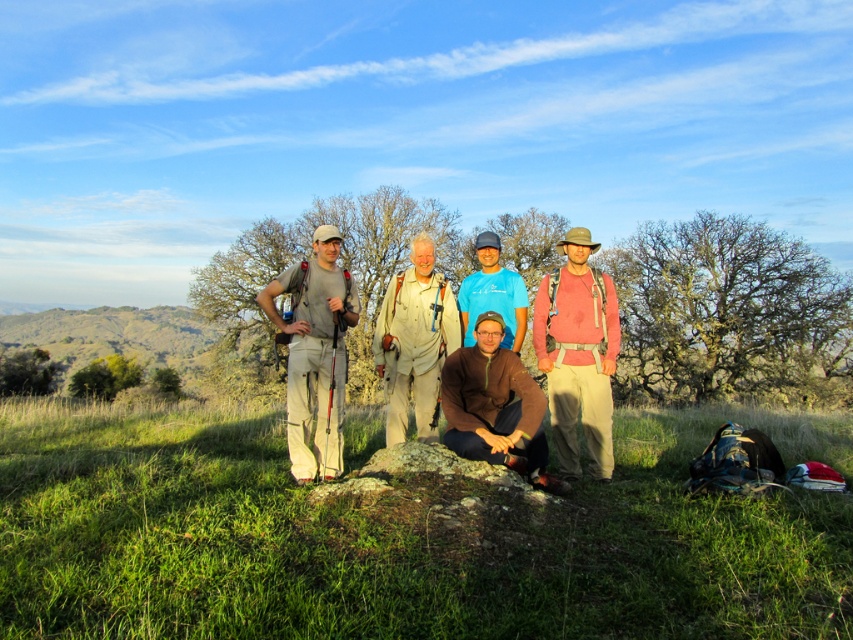
You are standing on the grassy hillside and want to take a photo of the group. You notice the matte gray pants at left and the brown matte sweater at center. Which one should you focus on first if you want to capture both in the frame without moving the camera?

You should focus on the brown matte sweater at center first because it is closer to the camera than the matte gray pants at left, allowing both to be in the frame without moving the camera.

You are a photographer trying to capture a group photo of the pink fabric shirt at center and the brown matte sweater at center. Since you want to ensure both subjects are in focus, you need to know their heights. Which of the two is taller?

The pink fabric shirt at center is much taller than the brown matte sweater at center, so the photographer should adjust the camera angle to account for the height difference to ensure both are in focus.